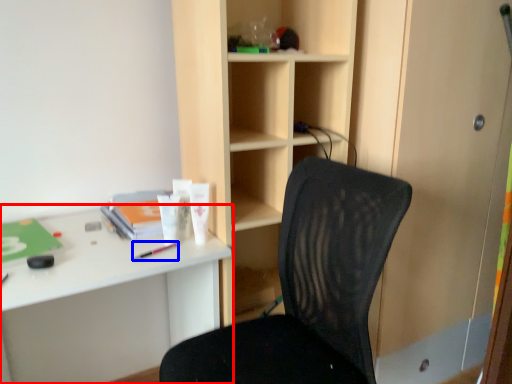
Question: Among these objects, which one is nearest to the camera, desk (highlighted by a red box) or stationery (highlighted by a blue box)?

Choices:
 (A) desk
 (B) stationery

Answer: (A)